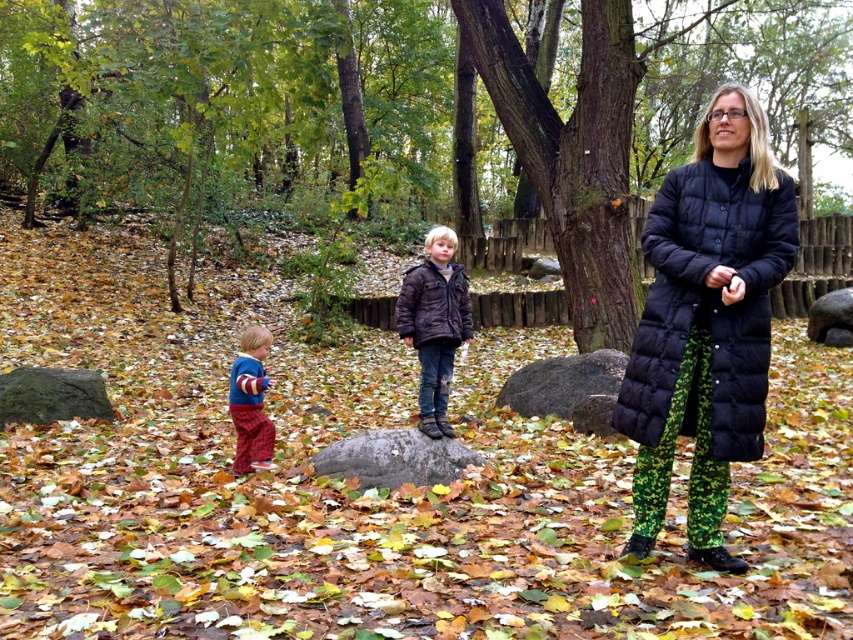
You are planning to place a 5 meter long wooden bench between the black puffer coat at right and the brown textured bark at center. Can the bench fit between them without overlapping either object?

The distance between the black puffer coat at right and the brown textured bark at center is 6.04 meters. Since the bench is 5 meters long, it can fit between them with approximately 1.04 meters of space remaining on either side.

You are standing in the autumn woods and see the black puffer coat at right and the brown textured bark at center. Which object is closer to the ground?

The black puffer coat at right is located below brown textured bark at center, so it is closer to the ground.

You are standing in the autumn woods and see two points marked in the scene. The first point is labeled as point (x=459, y=321) and the second is point (x=463, y=452). Which point is closer to you?

Point (x=459, y=321) is closer to you because it is further to the camera than point (x=463, y=452).